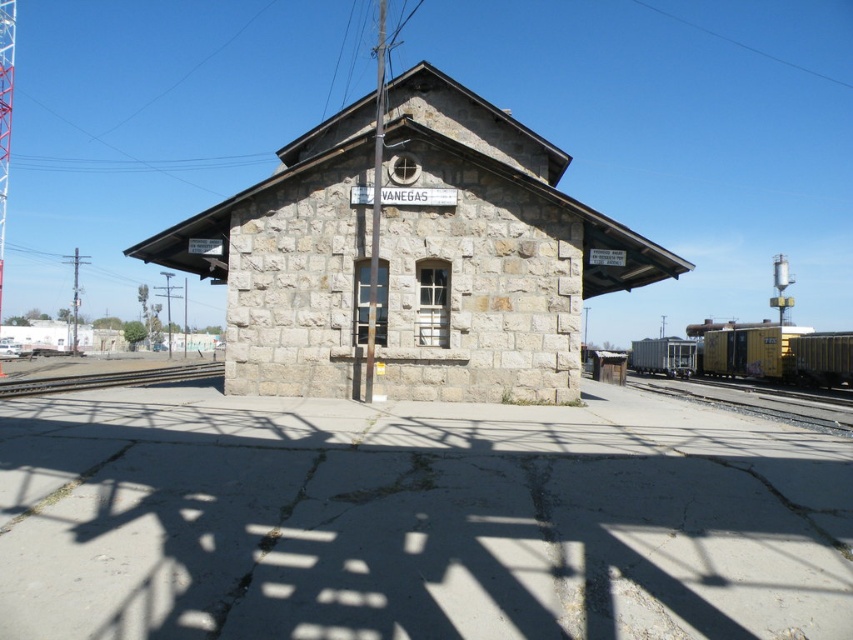
In the scene shown: Can you confirm if yellow painted metal train car at right is smaller than smooth yellow track at right?

Incorrect, yellow painted metal train car at right is not smaller in size than smooth yellow track at right.

Which is in front, point (740, 368) or point (637, 381)?

Positioned in front is point (637, 381).

What are the coordinates of `yellow painted metal train car at right` in the screenshot? It's located at (776, 353).

Is yellow painted metal train car at right behind brown wooden train track at lower left?

Yes, yellow painted metal train car at right is behind brown wooden train track at lower left.

Can you confirm if yellow painted metal train car at right is smaller than brown wooden train track at lower left?

No, yellow painted metal train car at right is not smaller than brown wooden train track at lower left.

Is point (770, 355) positioned after point (202, 369)?

No.

The height and width of the screenshot is (640, 853). What are the coordinates of `yellow painted metal train car at right` in the screenshot? It's located at (776, 353).

Is stone railway station at center to the right of brown wooden train track at lower left from the viewer's perspective?

Yes, stone railway station at center is to the right of brown wooden train track at lower left.

Who is positioned more to the right, stone railway station at center or brown wooden train track at lower left?

stone railway station at center

Who is more distant from viewer, (521, 195) or (24, 380)?

The point (24, 380) is behind.

Find the location of a particular element. The image size is (853, 640). stone railway station at center is located at coordinates (486, 252).